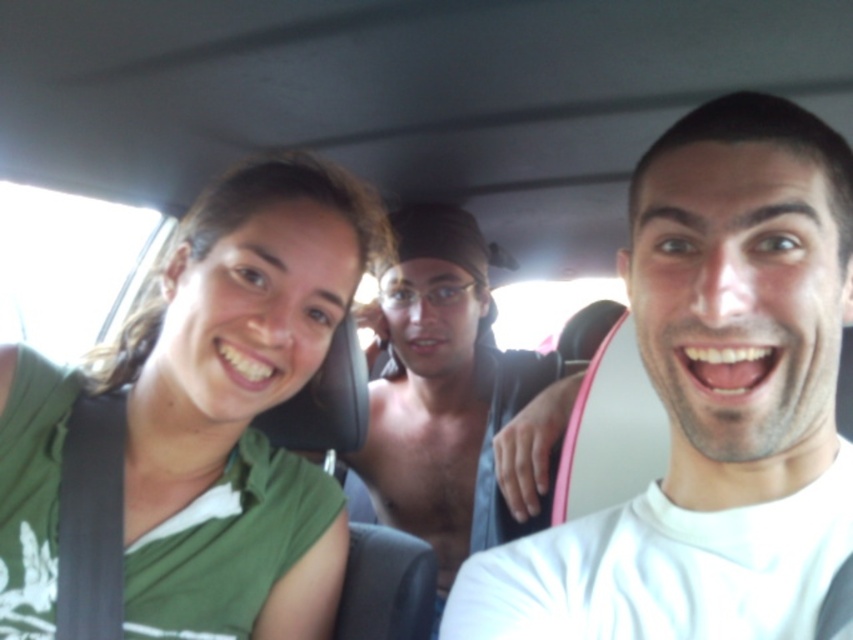
Question: Which of the following is the closest to the observer?

Choices:
 (A) green matte shirt at left
 (B) shiny black shirt at center
 (C) white matte shirt at center

Answer: (C)

Question: Is the position of white matte shirt at center more distant than that of shiny black shirt at center?

Choices:
 (A) yes
 (B) no

Answer: (B)

Question: Considering the relative positions of green matte shirt at left and shiny black shirt at center in the image provided, where is green matte shirt at left located with respect to shiny black shirt at center?

Choices:
 (A) left
 (B) right

Answer: (A)

Question: Which of the following is the closest to the observer?

Choices:
 (A) (136, 316)
 (B) (508, 413)
 (C) (706, 320)

Answer: (C)

Question: Which point is closer to the camera?

Choices:
 (A) green matte shirt at left
 (B) shiny black shirt at center
 (C) white matte shirt at center

Answer: (C)

Question: Can you confirm if white matte shirt at center is bigger than shiny black shirt at center?

Choices:
 (A) no
 (B) yes

Answer: (A)